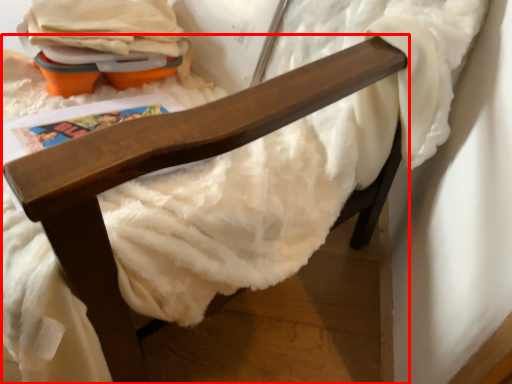
Question: From the image's perspective, where is furniture (annotated by the red box) located in relation to toy in the image?

Choices:
 (A) above
 (B) below

Answer: (B)